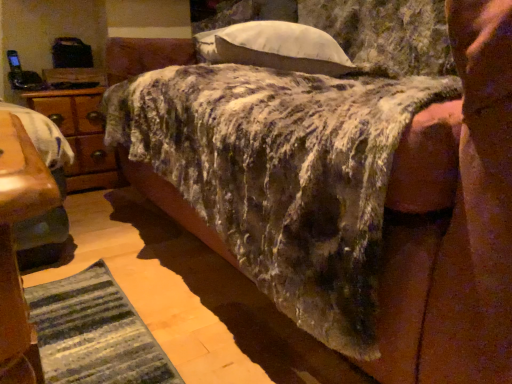
What is the approximate width of wooden nightstand at left?

The width of wooden nightstand at left is 16.65 inches.

Locate an element on the screen. Image resolution: width=512 pixels, height=384 pixels. white soft pillow at upper center is located at coordinates (275, 47).

From a real-world perspective, is white soft pillow at upper center physically below fuzzy fabric mattress at center?

No, from a real-world perspective, white soft pillow at upper center is not below fuzzy fabric mattress at center.

How far apart are white soft pillow at upper center and fuzzy fabric mattress at center?

white soft pillow at upper center is 12.36 inches from fuzzy fabric mattress at center.

Considering the points (319, 64) and (239, 208), which point is in front, point (319, 64) or point (239, 208)?

Positioned in front is point (239, 208).

Is white soft pillow at upper center inside the boundaries of fuzzy fabric mattress at center, or outside?

white soft pillow at upper center is contained in fuzzy fabric mattress at center.

Who is smaller, wooden nightstand at left or white soft pillow at upper center?

white soft pillow at upper center.

From a real-world perspective, is wooden nightstand at left physically located above or below white soft pillow at upper center?

From a real-world perspective, wooden nightstand at left is physically below white soft pillow at upper center.

Is the surface of fuzzy fabric mattress at center in direct contact with white soft pillow at upper center?

No, fuzzy fabric mattress at center is not touching white soft pillow at upper center.

Is white soft pillow at upper center at the back of fuzzy fabric mattress at center?

Yes.

Find the location of a particular element. Image resolution: width=512 pixels, height=384 pixels. pillow above the fuzzy fabric mattress at center (from the image's perspective) is located at coordinates (275, 47).

Looking at this image, considering the sizes of objects fuzzy fabric mattress at center and white soft pillow at upper center in the image provided, who is bigger, fuzzy fabric mattress at center or white soft pillow at upper center?

fuzzy fabric mattress at center.

Choose the correct answer: Is wooden nightstand at left inside fuzzy fabric mattress at center or outside it?

wooden nightstand at left is outside fuzzy fabric mattress at center.

Does wooden nightstand at left have a lesser width compared to fuzzy fabric mattress at center?

Yes, wooden nightstand at left is thinner than fuzzy fabric mattress at center.

From a real-world perspective, who is located lower, wooden nightstand at left or fuzzy fabric mattress at center?

wooden nightstand at left is physically lower.

Is white soft pillow at upper center looking in the opposite direction of wooden nightstand at left?

No, wooden nightstand at left is not at the back of white soft pillow at upper center.

Is white soft pillow at upper center at the left side of wooden nightstand at left?

No.

Is white soft pillow at upper center not close to wooden nightstand at left?

white soft pillow at upper center is actually quite close to wooden nightstand at left.

Is point (321, 48) in front of point (51, 98)?

That is True.

Which object is thinner, fuzzy fabric mattress at center or wooden nightstand at left?

wooden nightstand at left is thinner.

Can you confirm if fuzzy fabric mattress at center is taller than wooden nightstand at left?

Yes, fuzzy fabric mattress at center is taller than wooden nightstand at left.

You are a GUI agent. You are given a task and a screenshot of the screen. Output one action in this format:
    pyautogui.click(x=<x>, y=<y>)
    Task: Click on the mattress below the wooden nightstand at left (from the image's perspective)
    The width and height of the screenshot is (512, 384).
    Given the screenshot: What is the action you would take?
    pyautogui.click(x=282, y=175)

Can wooden nightstand at left be found inside fuzzy fabric mattress at center?

Actually, wooden nightstand at left is outside fuzzy fabric mattress at center.

You are a GUI agent. You are given a task and a screenshot of the screen. Output one action in this format:
    pyautogui.click(x=<x>, y=<y>)
    Task: Click on the mattress below the white soft pillow at upper center (from a real-world perspective)
    This screenshot has height=384, width=512.
    Given the screenshot: What is the action you would take?
    pyautogui.click(x=282, y=175)

The height and width of the screenshot is (384, 512). I want to click on nightstand behind the white soft pillow at upper center, so click(x=80, y=135).

Based on their spatial positions, is white soft pillow at upper center or fuzzy fabric mattress at center further from wooden nightstand at left?

Among the two, fuzzy fabric mattress at center is located further to wooden nightstand at left.

In the scene shown: When comparing their distances from fuzzy fabric mattress at center, does white soft pillow at upper center or wooden nightstand at left seem further?

Based on the image, wooden nightstand at left appears to be further to fuzzy fabric mattress at center.

Looking at the image, which one is located further to fuzzy fabric mattress at center, wooden nightstand at left or white soft pillow at upper center?

Based on the image, wooden nightstand at left appears to be further to fuzzy fabric mattress at center.

Which object lies further to the anchor point white soft pillow at upper center, wooden nightstand at left or fuzzy fabric mattress at center?

Among the two, wooden nightstand at left is located further to white soft pillow at upper center.

Based on the photo, estimate the real-world distances between objects in this image. Which object is closer to wooden nightstand at left, fuzzy fabric mattress at center or white soft pillow at upper center?

white soft pillow at upper center is positioned closer to the anchor wooden nightstand at left.

Considering their positions, is fuzzy fabric mattress at center positioned closer to white soft pillow at upper center than wooden nightstand at left?

fuzzy fabric mattress at center lies closer to white soft pillow at upper center than the other object.

Where is `pillow between fuzzy fabric mattress at center and wooden nightstand at left along the z-axis`? The height and width of the screenshot is (384, 512). pillow between fuzzy fabric mattress at center and wooden nightstand at left along the z-axis is located at coordinates (275, 47).